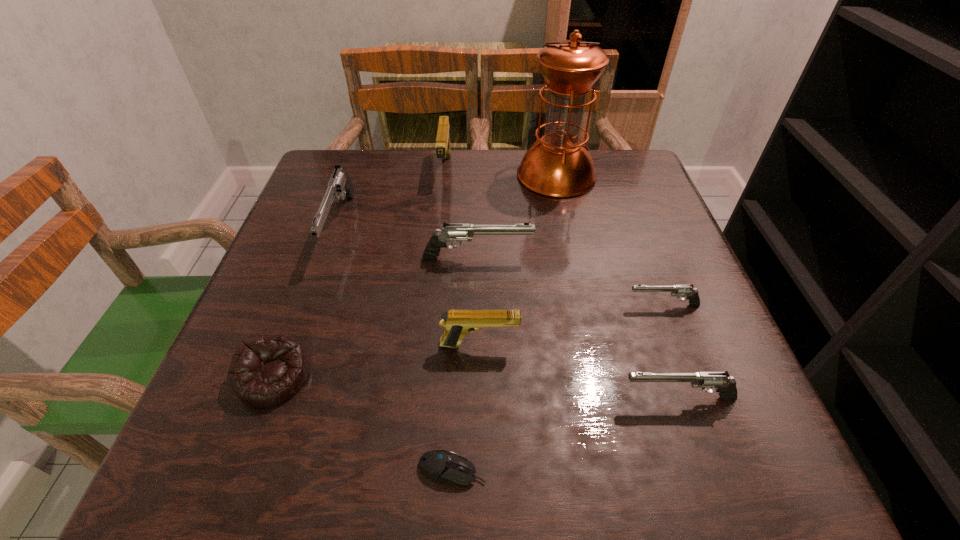
I want to click on vacant space located on the front-facing side of the nearest pistol, so click(498, 399).

Locate an element on the screen. Image resolution: width=960 pixels, height=540 pixels. vacant space situated 0.340m on the front-facing side of the nearest pistol is located at coordinates (402, 399).

At what (x,y) coordinates should I click in order to perform the action: click on free space located on the front-facing side of the nearest pistol. Please return your answer as a coordinate pair (x, y). Looking at the image, I should click on (408, 399).

At what (x,y) coordinates should I click in order to perform the action: click on free region located 0.250m on the front-facing side of the smallest silver pistol. Please return your answer as a coordinate pair (x, y). This screenshot has height=540, width=960. Looking at the image, I should click on (492, 305).

Find the location of a particular element. free space located 0.080m on the front-facing side of the smallest silver pistol is located at coordinates (584, 305).

At what (x,y) coordinates should I click in order to perform the action: click on vacant area located on the front-facing side of the smallest silver pistol. Please return your answer as a coordinate pair (x, y). Image resolution: width=960 pixels, height=540 pixels. Looking at the image, I should click on (524, 305).

I want to click on free location located on the back of the brown beanbag, so click(332, 219).

Identify the location of free spot located 0.090m on the left of the nearest object. This screenshot has width=960, height=540. (353, 470).

The image size is (960, 540). I want to click on oil lamp that is positioned at the far edge, so click(x=559, y=165).

At what (x,y) coordinates should I click in order to perform the action: click on object that is positioned at the near edge. Please return your answer as a coordinate pair (x, y). Image resolution: width=960 pixels, height=540 pixels. Looking at the image, I should click on (439, 465).